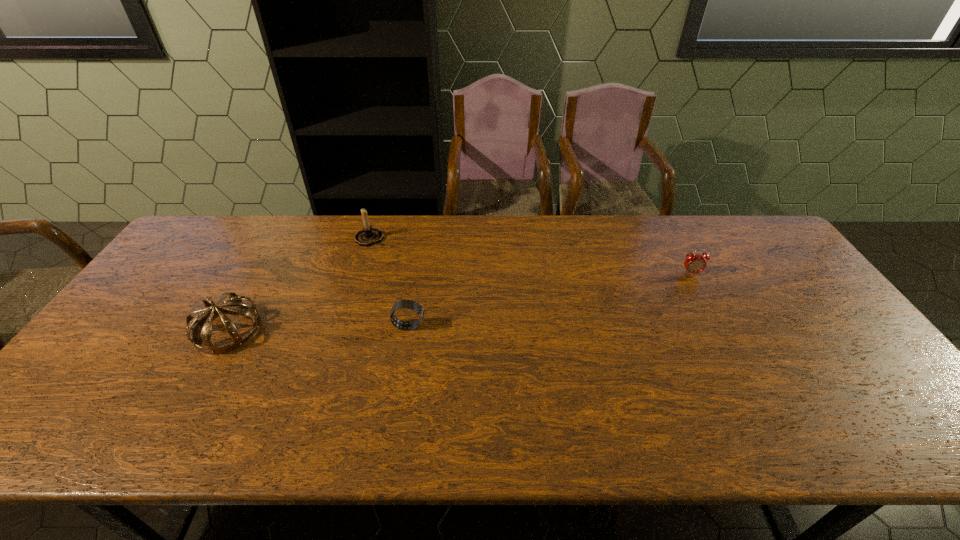
At what (x,y) coordinates should I click in order to perform the action: click on free space between the alarm clock and the candle holder. Please return your answer as a coordinate pair (x, y). Looking at the image, I should click on (530, 256).

Locate an element on the screen. empty location between the farthest object and the leftmost object is located at coordinates (299, 284).

Where is `free space between the farthest object and the leftmost object`? The image size is (960, 540). free space between the farthest object and the leftmost object is located at coordinates coord(299,284).

At what (x,y) coordinates should I click in order to perform the action: click on vacant region between the leftmost object and the third object from left to right. Please return your answer as a coordinate pair (x, y). This screenshot has height=540, width=960. Looking at the image, I should click on (319, 328).

In order to click on free space between the rightmost object and the watch in this screenshot , I will do pos(550,300).

The height and width of the screenshot is (540, 960). What are the coordinates of `vacant area between the second farthest object and the second object from right to left` in the screenshot? It's located at (550, 300).

Locate an element on the screen. free space between the tiara and the candle holder is located at coordinates (299, 284).

Identify which object is located as the third nearest to the second object from right to left. Please provide its 2D coordinates. Your answer should be formatted as a tuple, i.e. [(x, y)], where the tuple contains the x and y coordinates of a point satisfying the conditions above.

[(694, 263)]

Locate an element on the screen. the second closest object to the third object from left to right is located at coordinates (236, 305).

This screenshot has width=960, height=540. Find the location of `free space that satisfies the following two spatial constraints: 1. on the face of the watch; 2. on the front side of the leftmost object`. free space that satisfies the following two spatial constraints: 1. on the face of the watch; 2. on the front side of the leftmost object is located at coordinates pyautogui.click(x=408, y=330).